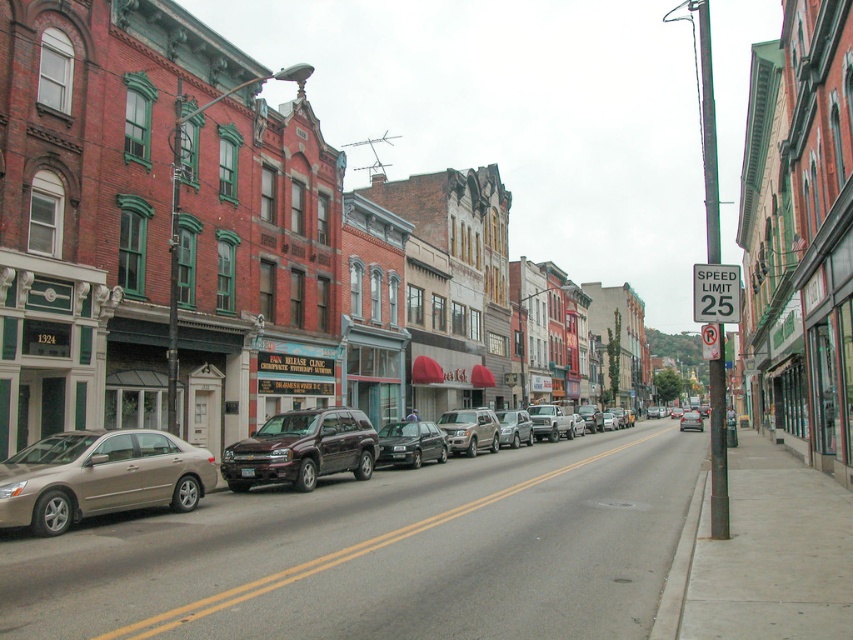
Question: Can you confirm if gold metallic sedan at left is positioned to the left of gold metallic car at left?

Choices:
 (A) no
 (B) yes

Answer: (B)

Question: Which of the following is the farthest from the observer?

Choices:
 (A) (502, 416)
 (B) (689, 419)

Answer: (B)

Question: Which point appears closest to the camera in this image?

Choices:
 (A) (294, 467)
 (B) (695, 417)

Answer: (A)

Question: Is gold metallic sedan at lower left above gold metallic car at left?

Choices:
 (A) yes
 (B) no

Answer: (A)

Question: Where is satin gold suv at center located in relation to metallic silver sedan at center in the image?

Choices:
 (A) below
 (B) above

Answer: (B)

Question: Estimate the real-world distances between objects in this image. Which object is farther from the gold metallic sedan at left?

Choices:
 (A) gold metallic car at left
 (B) metallic silver sedan at center
 (C) metallic silver car at center

Answer: (B)